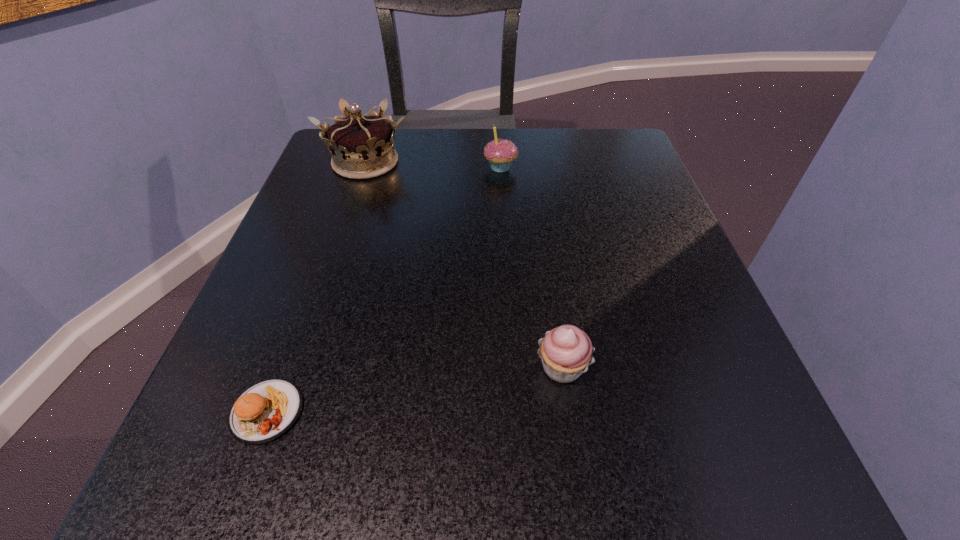
Find the location of a particular element. Image resolution: width=960 pixels, height=540 pixels. crown at the far edge is located at coordinates (362, 147).

Identify the location of cupcake located at the far edge. This screenshot has width=960, height=540. (500, 153).

Image resolution: width=960 pixels, height=540 pixels. Find the location of `object at the near edge`. object at the near edge is located at coordinates (265, 411).

At what (x,y) coordinates should I click in order to perform the action: click on crown situated at the left edge. Please return your answer as a coordinate pair (x, y). The image size is (960, 540). Looking at the image, I should click on (362, 147).

The height and width of the screenshot is (540, 960). I want to click on patty at the left edge, so click(265, 411).

This screenshot has width=960, height=540. I want to click on object that is at the far left corner, so click(362, 147).

At what (x,y) coordinates should I click in order to perform the action: click on object located at the near left corner. Please return your answer as a coordinate pair (x, y). The width and height of the screenshot is (960, 540). Looking at the image, I should click on (265, 411).

You are a GUI agent. You are given a task and a screenshot of the screen. Output one action in this format:
    pyautogui.click(x=<x>, y=<y>)
    Task: Click on the vacant space at the far edge of the desktop
    Image resolution: width=960 pixels, height=540 pixels.
    Given the screenshot: What is the action you would take?
    465,133

Locate an element on the screen. This screenshot has height=540, width=960. free region at the left edge of the desktop is located at coordinates (347, 326).

Where is `free spot at the right edge of the desktop`? free spot at the right edge of the desktop is located at coordinates (639, 221).